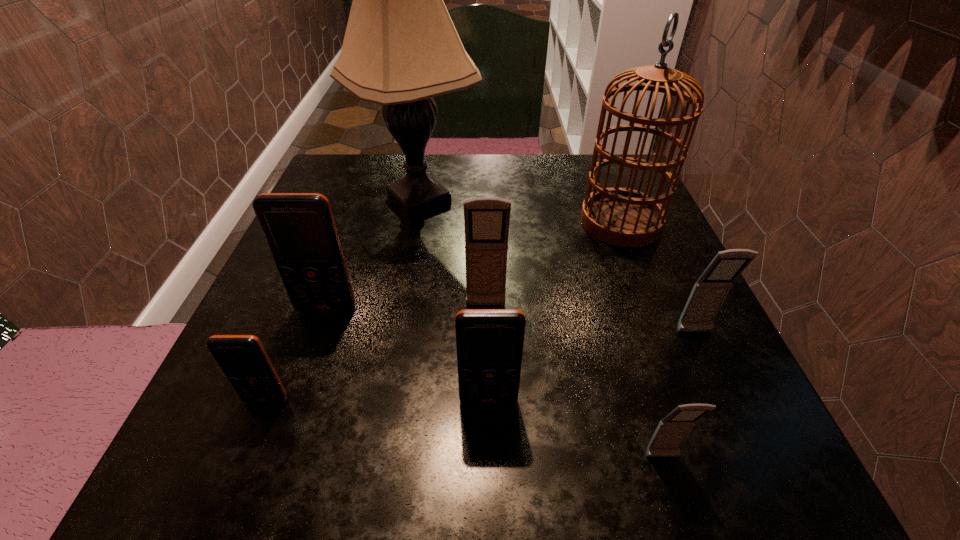
Locate an element on the screen. The image size is (960, 540). the second gray cellular telephone from right to left is located at coordinates (671, 432).

Identify the location of the nearest object. pyautogui.click(x=671, y=432).

The height and width of the screenshot is (540, 960). I want to click on vacant region located 0.050m on the right of the tallest object, so click(x=505, y=200).

The width and height of the screenshot is (960, 540). I want to click on blank area located 0.400m on the front of the seventh shortest object, so pyautogui.click(x=708, y=443).

Locate an element on the screen. The width and height of the screenshot is (960, 540). free spot located on the front-facing side of the biggest gray cellular telephone is located at coordinates (487, 341).

You are a GUI agent. You are given a task and a screenshot of the screen. Output one action in this format:
    pyautogui.click(x=<x>, y=<y>)
    Task: Click on the vacant region located 0.220m on the screen of the biggest orange cellular telephone
    Image resolution: width=960 pixels, height=540 pixels.
    Given the screenshot: What is the action you would take?
    pyautogui.click(x=281, y=441)

Find the location of a particular element. Image resolution: width=960 pixels, height=540 pixels. free space located 0.190m on the front-facing side of the rightmost cellular telephone is located at coordinates (751, 456).

Find the location of a particular element. vacant space located 0.120m on the screen of the second smallest orange cellular telephone is located at coordinates (491, 497).

You are a GUI agent. You are given a task and a screenshot of the screen. Output one action in this format:
    pyautogui.click(x=<x>, y=<y>)
    Task: Click on the vacant space located 0.110m on the screen of the smallest orange cellular telephone
    The height and width of the screenshot is (540, 960).
    Given the screenshot: What is the action you would take?
    pyautogui.click(x=232, y=486)

This screenshot has width=960, height=540. Find the location of `lamp that is positioned at the far edge`. lamp that is positioned at the far edge is located at coordinates (400, 49).